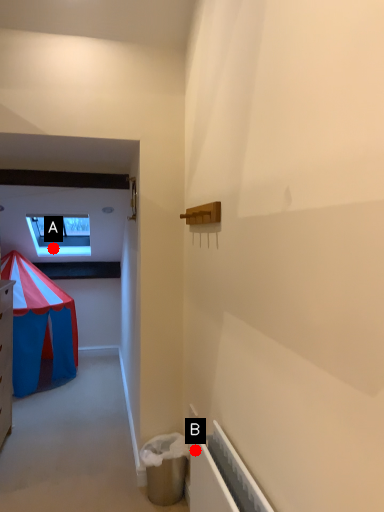
Question: Two points are circled on the image, labeled by A and B beside each circle. Among these points, which one is nearest to the camera?

Choices:
 (A) A is closer
 (B) B is closer

Answer: (B)